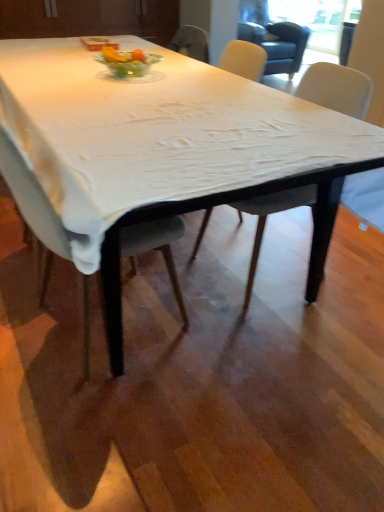
Find the location of a particular element. free space in front of white fabric chair at center, positioned as the 2th chair in left-to-right order is located at coordinates (276, 338).